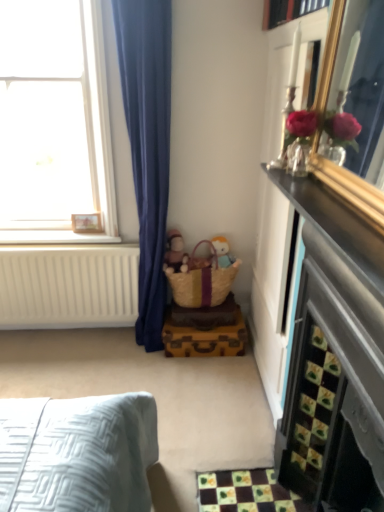
Identify the location of vacant space in front of wooden picture frame at upper left. (81, 238).